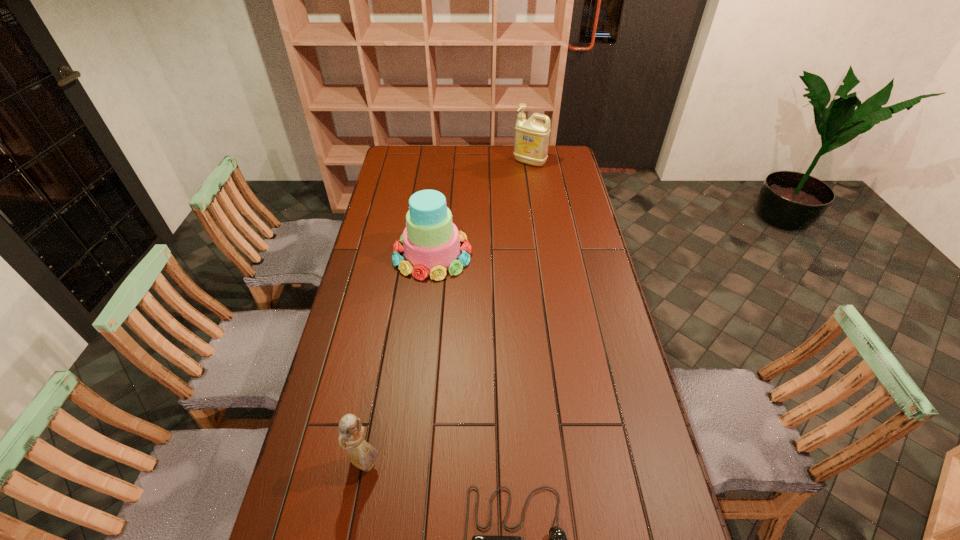
Find the location of a particular element. the closest object relative to the second shortest object is located at coordinates (557, 539).

This screenshot has height=540, width=960. In order to click on object that stands as the third closest to the detergent in this screenshot , I will do `click(557, 539)`.

What are the coordinates of `vacant region that satisfies the following two spatial constraints: 1. on the front side of the detergent; 2. on the front-facing side of the third farthest object` in the screenshot? It's located at (576, 463).

Image resolution: width=960 pixels, height=540 pixels. What are the coordinates of `vacant space that satisfies the following two spatial constraints: 1. on the back side of the farthest object; 2. on the right side of the second farthest object` in the screenshot? It's located at (443, 162).

At what (x,y) coordinates should I click in order to perform the action: click on free region that satisfies the following two spatial constraints: 1. on the front side of the cake; 2. on the front-facing side of the figurine. Please return your answer as a coordinate pair (x, y). Looking at the image, I should click on [x=409, y=463].

This screenshot has height=540, width=960. Identify the location of free space that satisfies the following two spatial constraints: 1. on the back side of the cake; 2. on the right side of the detergent. (443, 162).

Where is `free region that satisfies the following two spatial constraints: 1. on the front side of the second farthest object; 2. on the front-facing side of the figurine`? free region that satisfies the following two spatial constraints: 1. on the front side of the second farthest object; 2. on the front-facing side of the figurine is located at coordinates (409, 463).